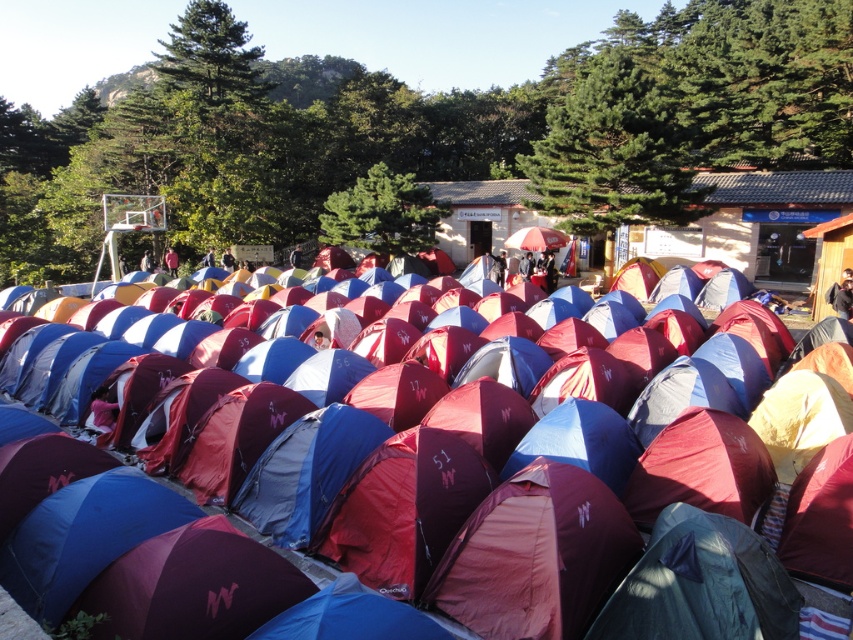
Question: Among these points, which one is nearest to the camera?

Choices:
 (A) (508, 244)
 (B) (544, 406)

Answer: (B)

Question: Does blue fabric tent at center lie in front of red fabric umbrella at center?

Choices:
 (A) no
 (B) yes

Answer: (B)

Question: Does blue fabric tent at center appear on the right side of red fabric umbrella at center?

Choices:
 (A) yes
 (B) no

Answer: (B)

Question: Which of the following is the farthest from the observer?

Choices:
 (A) red fabric umbrella at center
 (B) blue fabric tent at center

Answer: (A)

Question: Which point is farther to the camera?

Choices:
 (A) [x=544, y=232]
 (B) [x=769, y=468]

Answer: (A)

Question: Does blue fabric tent at center appear over red fabric umbrella at center?

Choices:
 (A) no
 (B) yes

Answer: (A)